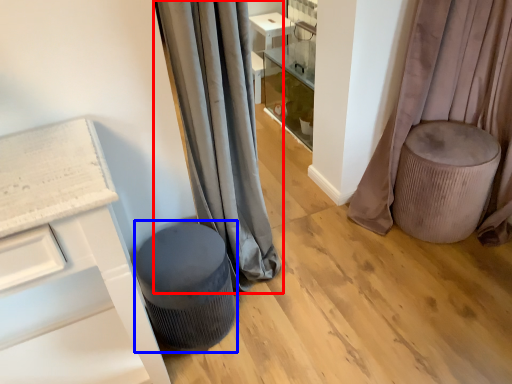
Question: Which object is further to the camera taking this photo, curtain (highlighted by a red box) or music stool (highlighted by a blue box)?

Choices:
 (A) curtain
 (B) music stool

Answer: (B)